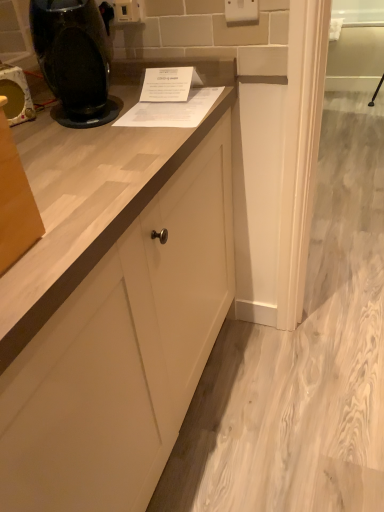
Question: From a real-world perspective, is white plastic electric outlet at upper center, the second electric outlet from the left, beneath matte black coffee machine at left?

Choices:
 (A) yes
 (B) no

Answer: (B)

Question: Considering the relative sizes of white plastic electric outlet at upper center, which is counted as the 1th electric outlet, starting from the right, and matte black coffee machine at left in the image provided, is white plastic electric outlet at upper center, which is counted as the 1th electric outlet, starting from the right, smaller than matte black coffee machine at left?

Choices:
 (A) yes
 (B) no

Answer: (A)

Question: From a real-world perspective, is white plastic electric outlet at upper center, which is counted as the 1th electric outlet, starting from the right, on matte black coffee machine at left?

Choices:
 (A) no
 (B) yes

Answer: (B)

Question: Is white plastic electric outlet at upper center, which appears as the second electric outlet when viewed from the back, in front of matte black coffee machine at left?

Choices:
 (A) yes
 (B) no

Answer: (B)

Question: Can we say white plastic electric outlet at upper center, positioned as the 1th electric outlet in front-to-back order, lies outside matte black coffee machine at left?

Choices:
 (A) yes
 (B) no

Answer: (A)

Question: From the image's perspective, is white plastic electric outlet at upper center, positioned as the 1th electric outlet in front-to-back order, beneath matte black coffee machine at left?

Choices:
 (A) no
 (B) yes

Answer: (A)

Question: Is white plastic electric outlet at upper center, which appears as the second electric outlet when viewed from the back, a part of black glossy coffee machine at upper left?

Choices:
 (A) yes
 (B) no

Answer: (B)

Question: From a real-world perspective, is black glossy coffee machine at upper left positioned over white plastic electric outlet at upper center, which appears as the second electric outlet when viewed from the back, based on gravity?

Choices:
 (A) no
 (B) yes

Answer: (A)

Question: Is black glossy coffee machine at upper left at the left side of white plastic electric outlet at upper center, which is counted as the 1th electric outlet, starting from the right?

Choices:
 (A) yes
 (B) no

Answer: (A)

Question: From a real-world perspective, is black glossy coffee machine at upper left located beneath white plastic electric outlet at upper center, which appears as the second electric outlet when viewed from the back?

Choices:
 (A) no
 (B) yes

Answer: (B)

Question: Is black glossy coffee machine at upper left oriented towards white plastic electric outlet at upper center, the second electric outlet from the left?

Choices:
 (A) yes
 (B) no

Answer: (B)

Question: Is black glossy coffee machine at upper left outside white plastic electric outlet at upper center, positioned as the 1th electric outlet in front-to-back order?

Choices:
 (A) yes
 (B) no

Answer: (A)

Question: From a real-world perspective, is white plastic electric outlet at upper center, the 2th electric outlet in the front-to-back sequence, located higher than matte black coffee machine at left?

Choices:
 (A) no
 (B) yes

Answer: (B)